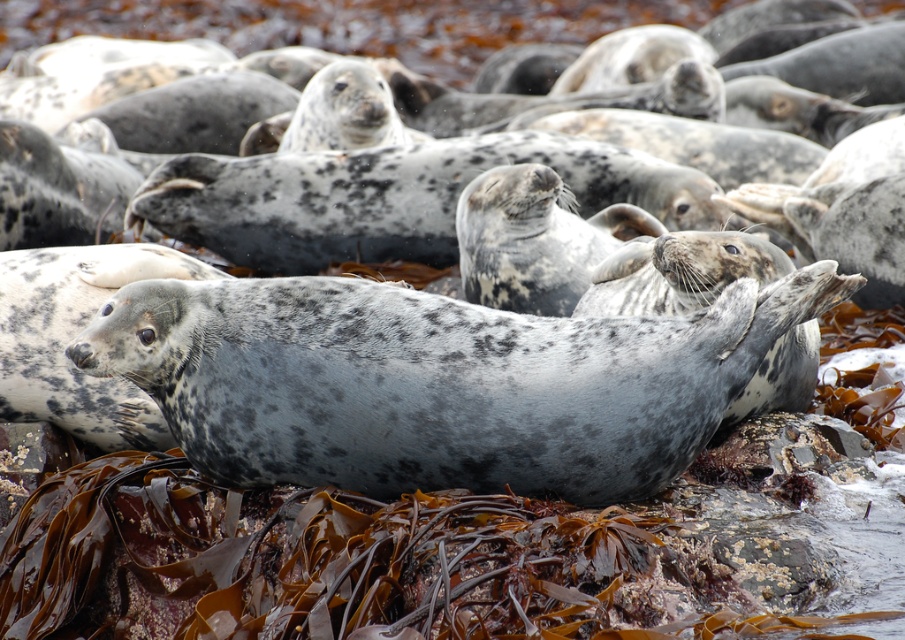
Does spotted fur seal at center appear on the left side of speckled fur seal at center?

No, spotted fur seal at center is not to the left of speckled fur seal at center.

Between spotted fur seal at center and speckled fur seal at center, which one appears on the left side from the viewer's perspective?

Positioned to the left is speckled fur seal at center.

Does point (239, 444) come closer to viewer compared to point (393, 156)?

Yes, point (239, 444) is in front of point (393, 156).

Find the location of a particular element. spotted fur seal at center is located at coordinates (437, 381).